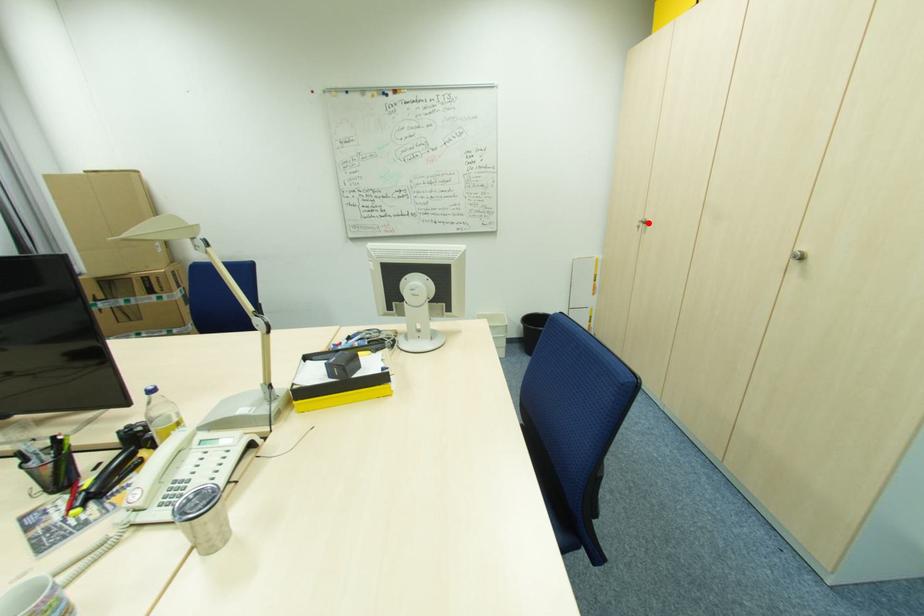
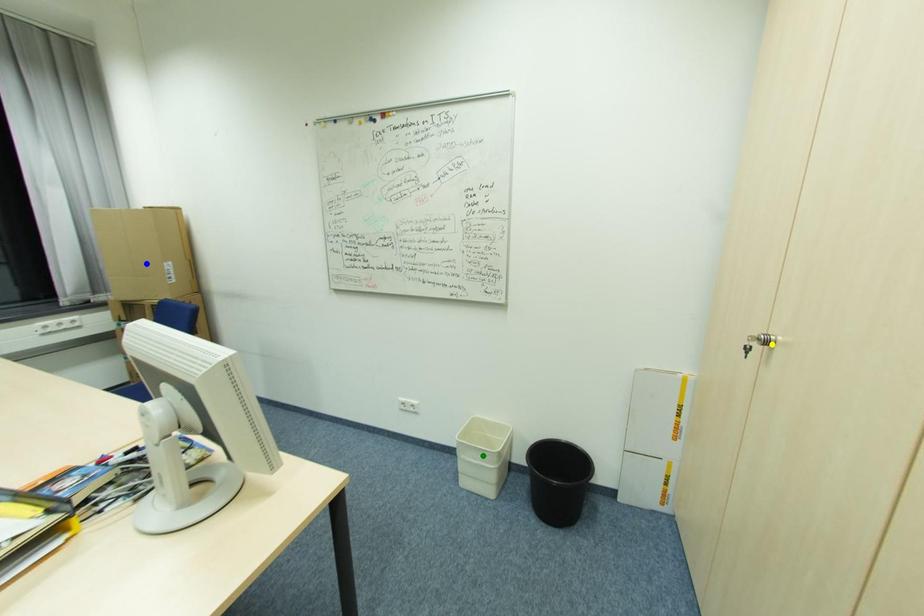
Question: I am providing you with two images of the same scene from different viewpoints. A red point is marked on the first image. You are given multiple points on the second image. Which mark in image 2 goes with the point in image 1?

Choices:
 (A) blue point
 (B) yellow point
 (C) green point

Answer: (B)